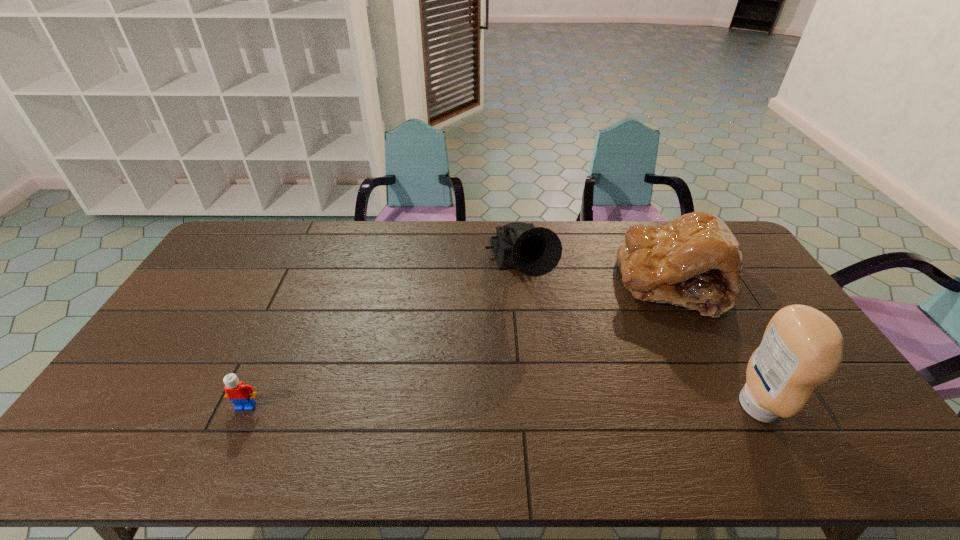
Identify the location of the leftmost object. The image size is (960, 540). (242, 395).

This screenshot has width=960, height=540. I want to click on the shortest object, so click(242, 395).

Locate an element on the screen. The width and height of the screenshot is (960, 540). condiment is located at coordinates (802, 348).

Where is `the second tallest object`? This screenshot has width=960, height=540. the second tallest object is located at coordinates (535, 251).

Locate an element on the screen. This screenshot has width=960, height=540. the second object from left to right is located at coordinates (535, 251).

Identify the location of bread. (695, 261).

The height and width of the screenshot is (540, 960). What are the coordinates of `vacant region located on the label of the condiment` in the screenshot? It's located at (798, 406).

In order to click on free space located 0.380m from the horn of the third shortest object in this screenshot , I will do `click(564, 412)`.

Identify the location of free space located from the horn of the third shortest object. (555, 386).

Locate an element on the screen. The height and width of the screenshot is (540, 960). vacant region located 0.330m from the horn of the third shortest object is located at coordinates (559, 395).